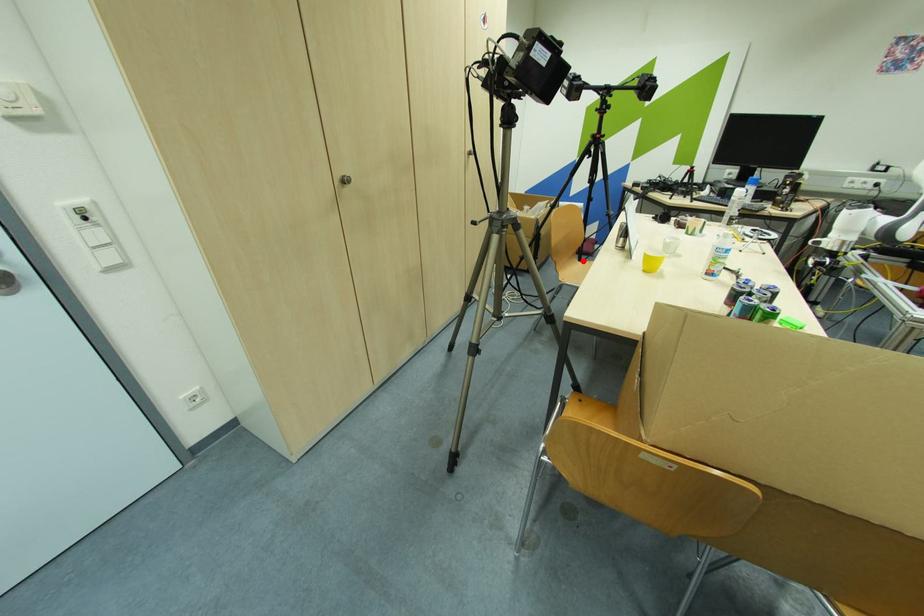
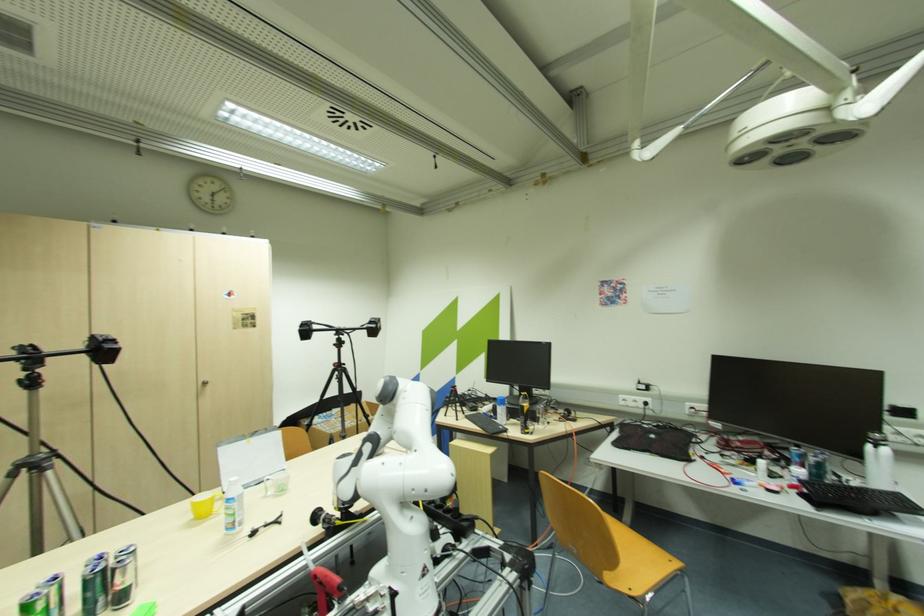
Question: I am providing you with two images of the same scene from different viewpoints. A red point is marked on the first image. Is the red point's position out of view in image 2?

Choices:
 (A) Yes
 (B) No

Answer: (A)